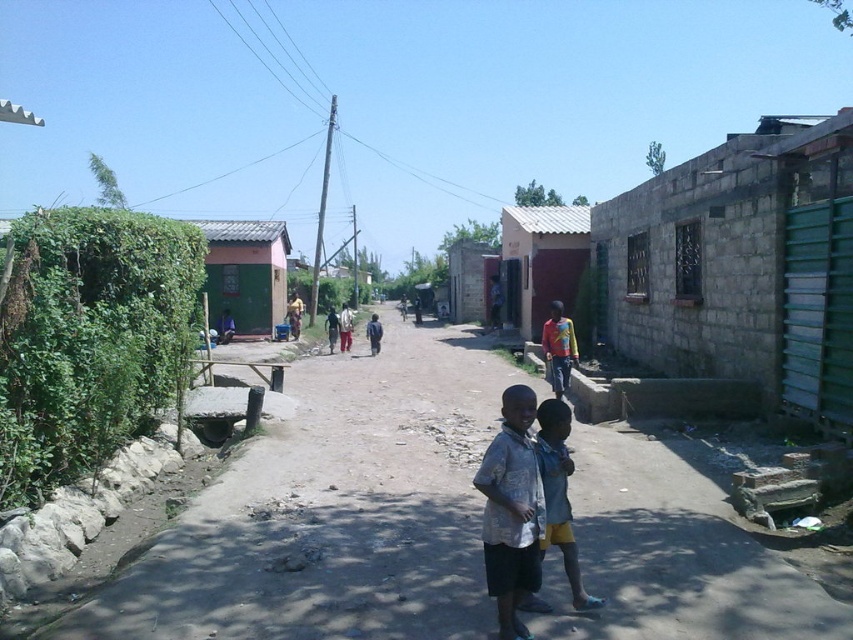
Is light blue printed shirt at center above light blue denim shorts at lower center?

Indeed, light blue printed shirt at center is positioned over light blue denim shorts at lower center.

Is point (500, 612) farther from viewer compared to point (550, 508)?

No, (500, 612) is in front of (550, 508).

Identify the location of light blue printed shirt at center. (511, 509).